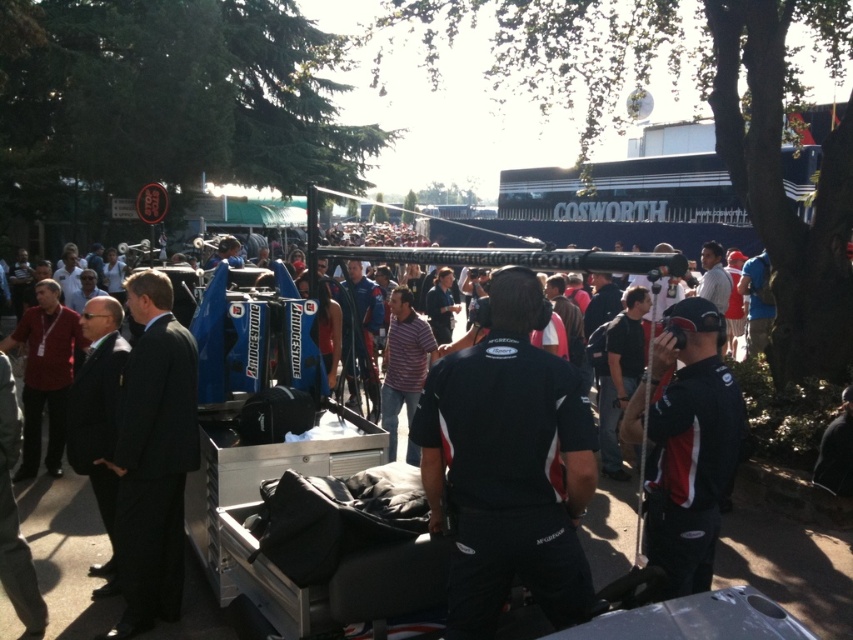
Question: Considering the relative positions of dark suit at center and black fabric jacket at center in the image provided, where is dark suit at center located with respect to black fabric jacket at center?

Choices:
 (A) right
 (B) left

Answer: (B)

Question: Which point is closer to the camera?

Choices:
 (A) black fabric shirt at center
 (B) dark suit at center
 (C) black fabric jacket at center

Answer: (A)

Question: Does dark suit at center appear on the left side of black fabric jacket at center?

Choices:
 (A) no
 (B) yes

Answer: (B)

Question: Which of the following is the closest to the observer?

Choices:
 (A) black fabric shirt at center
 (B) black fabric jacket at center
 (C) dark suit at center

Answer: (A)

Question: Is black fabric shirt at center smaller than dark suit at center?

Choices:
 (A) yes
 (B) no

Answer: (A)

Question: Which of the following is the closest to the observer?

Choices:
 (A) dark suit at center
 (B) black fabric jacket at center
 (C) black fabric shirt at center

Answer: (C)